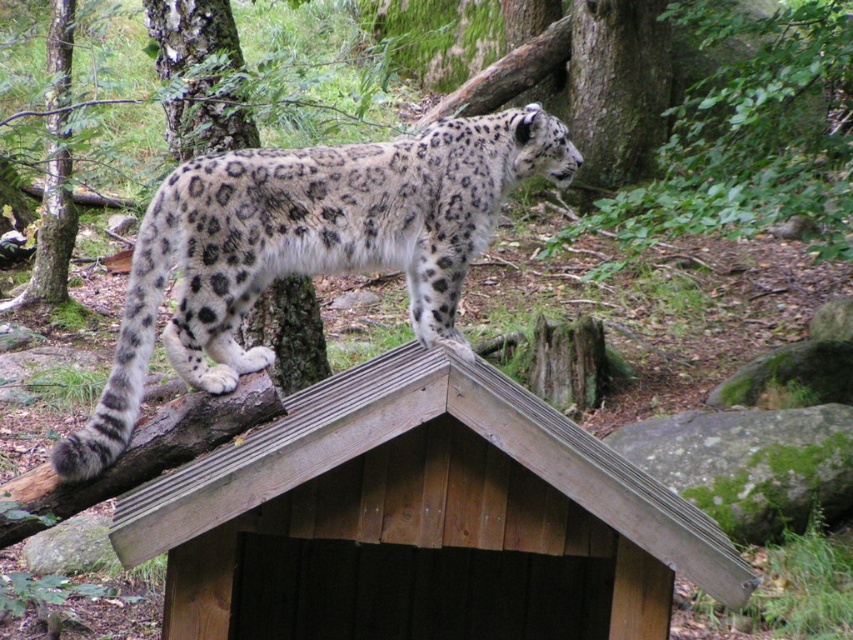
Is brown wooden hut at upper center below spotted fur leopard at center?

Yes.

Who is higher up, brown wooden hut at upper center or spotted fur leopard at center?

Positioned higher is spotted fur leopard at center.

You are a GUI agent. You are given a task and a screenshot of the screen. Output one action in this format:
    pyautogui.click(x=<x>, y=<y>)
    Task: Click on the brown wooden hut at upper center
    This screenshot has height=640, width=853.
    Given the screenshot: What is the action you would take?
    pyautogui.click(x=421, y=520)